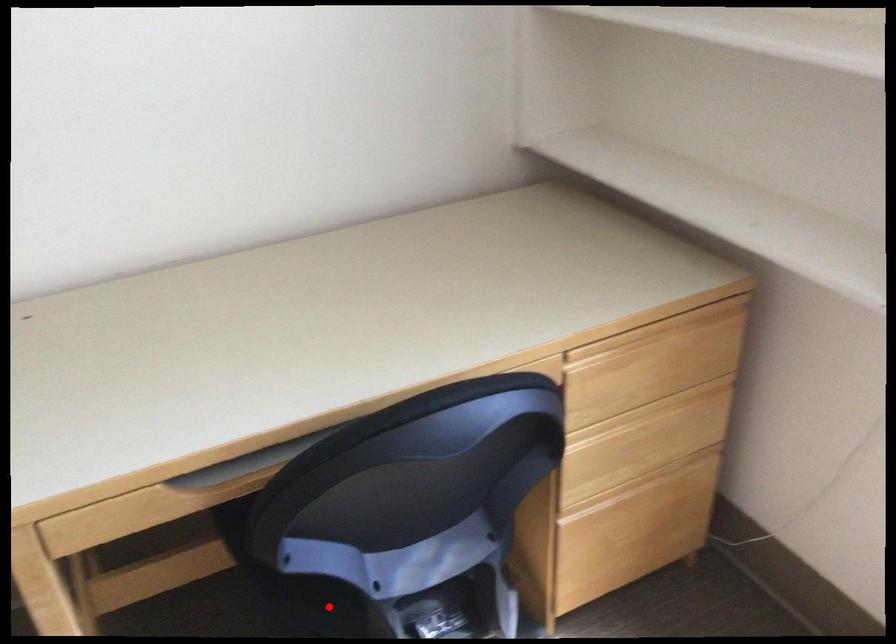
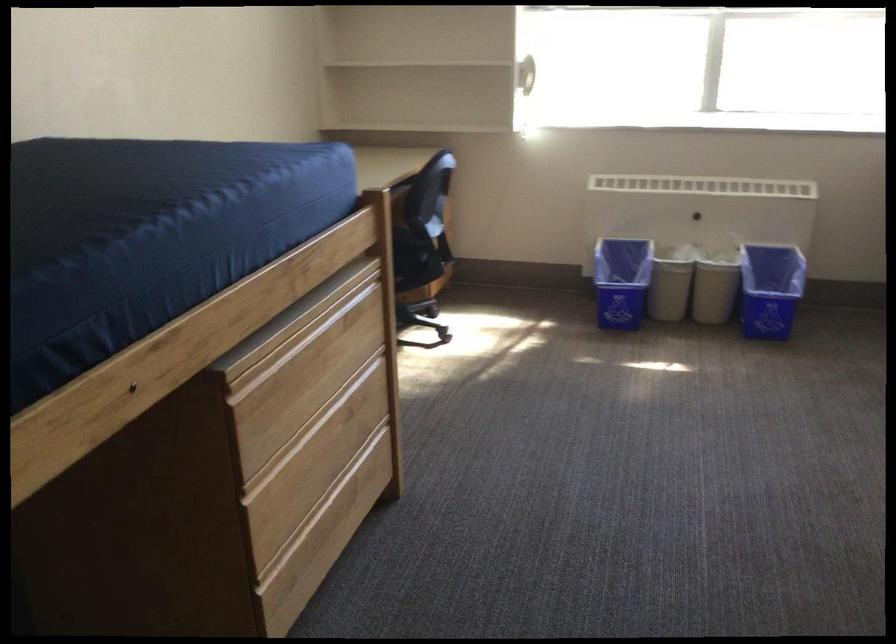
Question: I am providing you with two images of the same scene from different viewpoints. A red point is marked on the first image. At the location where the point appears in image 1, is it still visible in image 2?

Choices:
 (A) Yes
 (B) No

Answer: (B)